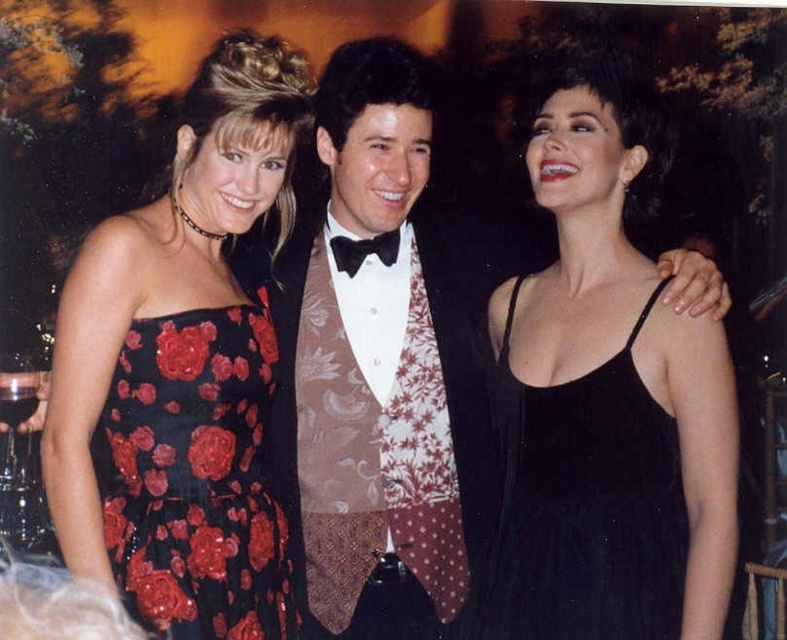
Question: Does black satin dress at center come behind black sequined dress at left?

Choices:
 (A) yes
 (B) no

Answer: (B)

Question: Among these objects, which one is nearest to the camera?

Choices:
 (A) black satin dress at center
 (B) black satin dress at left
 (C) black velvet dress at center

Answer: (A)

Question: Considering the real-world distances, which object is closest to the black satin bow tie at center?

Choices:
 (A) black sequined dress at left
 (B) black satin dress at left

Answer: (A)

Question: Considering the relative positions of black sequined dress at left and black satin bow tie at center in the image provided, where is black sequined dress at left located with respect to black satin bow tie at center?

Choices:
 (A) above
 (B) below

Answer: (B)

Question: Which is nearer to the black sequined dress at left?

Choices:
 (A) black satin dress at center
 (B) black satin dress at left
 (C) black velvet dress at center
 (D) black satin bow tie at center

Answer: (B)

Question: Is black sequined dress at left to the right of black velvet dress at center from the viewer's perspective?

Choices:
 (A) yes
 (B) no

Answer: (B)